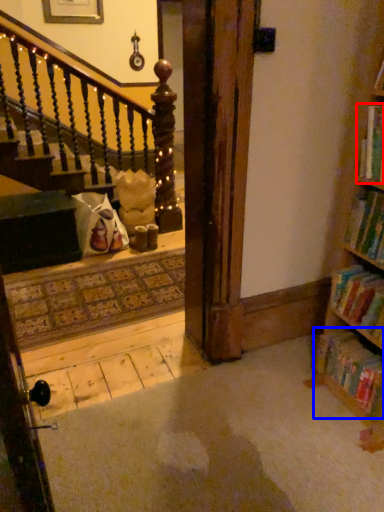
Question: Which point is further to the camera, book (highlighted by a red box) or book (highlighted by a blue box)?

Choices:
 (A) book
 (B) book

Answer: (B)